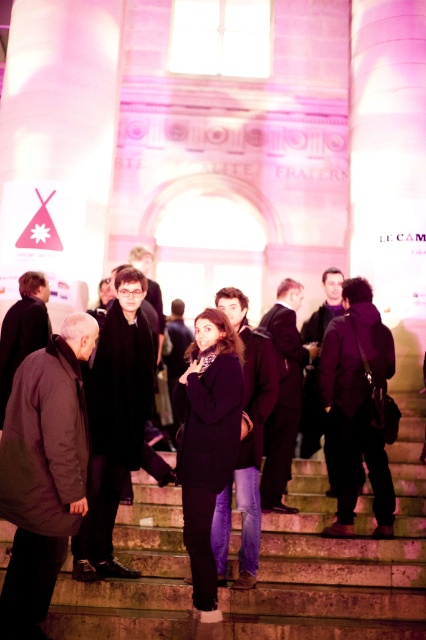
Question: Does stone stairs at center have a smaller size compared to dark purple coat at center?

Choices:
 (A) yes
 (B) no

Answer: (B)

Question: Can you confirm if stone stairs at center is thinner than dark purple coat at center?

Choices:
 (A) no
 (B) yes

Answer: (A)

Question: Is stone stairs at center below dark purple coat at center?

Choices:
 (A) no
 (B) yes

Answer: (B)

Question: Which point is farther to the camera?

Choices:
 (A) (282, 284)
 (B) (149, 508)
 (C) (385, 358)
 (D) (247, 355)

Answer: (A)

Question: Which point appears closest to the camera in this image?

Choices:
 (A) (374, 346)
 (B) (383, 563)

Answer: (B)

Question: Based on their relative distances, which object is farther from the stone stairs at center?

Choices:
 (A) purple matte jacket at center
 (B) matte purple coat at center
 (C) dark purple coat at center

Answer: (C)